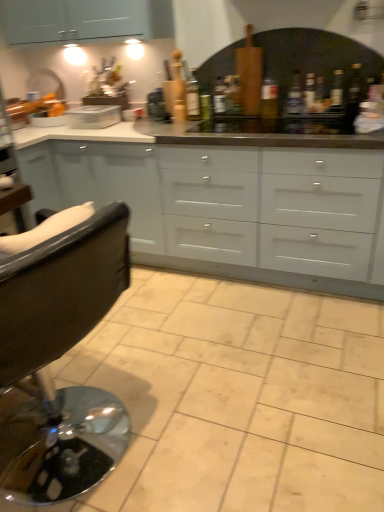
The height and width of the screenshot is (512, 384). I want to click on free location to the left of translucent glass bottle at upper right, which is counted as the fifth bottle, starting from the left, so click(x=309, y=120).